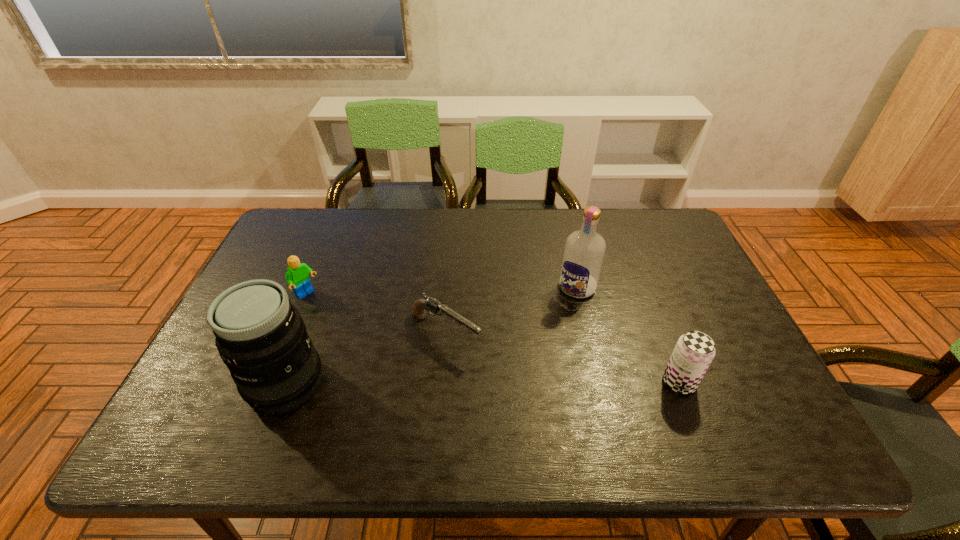
Image resolution: width=960 pixels, height=540 pixels. Identify the location of vacant space located 0.180m on the label of the fourth object from left to right. (539, 341).

The height and width of the screenshot is (540, 960). I want to click on free spot located 0.240m on the face of the Lego, so click(x=371, y=343).

Identify the location of free spot located on the face of the Lego. (346, 325).

At what (x,y) coordinates should I click in order to perform the action: click on free space located on the face of the Lego. Please return your answer as a coordinate pair (x, y). This screenshot has width=960, height=540. Looking at the image, I should click on (416, 377).

Image resolution: width=960 pixels, height=540 pixels. What are the coordinates of `vacant space positioned 0.140m aiming along the barrel of the third object from right to left` in the screenshot? It's located at (518, 379).

The width and height of the screenshot is (960, 540). Identify the location of vacant space located 0.110m aiming along the barrel of the third object from right to left. (508, 373).

You are a GUI agent. You are given a task and a screenshot of the screen. Output one action in this format:
    pyautogui.click(x=<x>, y=<y>)
    Task: Click on the free space located 0.100m aiming along the barrel of the third object from right to left
    The height and width of the screenshot is (540, 960).
    Given the screenshot: What is the action you would take?
    pyautogui.click(x=505, y=370)

The width and height of the screenshot is (960, 540). I want to click on telephoto lens present at the near edge, so click(261, 337).

At what (x,y) coordinates should I click in order to perform the action: click on beer can that is at the near edge. Please return your answer as a coordinate pair (x, y). Looking at the image, I should click on (694, 351).

Where is `telephoto lens located in the left edge section of the desktop`? This screenshot has width=960, height=540. telephoto lens located in the left edge section of the desktop is located at coordinates pos(261,337).